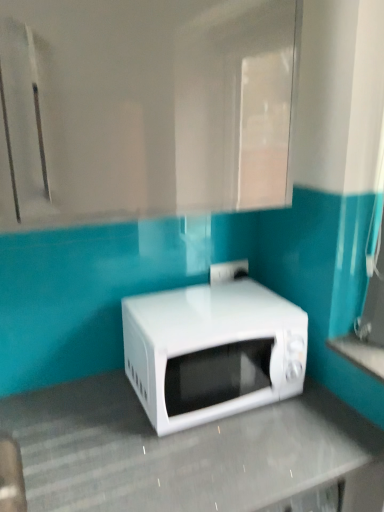
Question: From a real-world perspective, is white glossy countertop at lower right, placed as the second counter top when sorted from bottom to top, below white glossy microwave at center?

Choices:
 (A) no
 (B) yes

Answer: (A)

Question: Does white glossy countertop at lower right, the first counter top when ordered from top to bottom, appear on the right side of white glossy microwave at center?

Choices:
 (A) yes
 (B) no

Answer: (A)

Question: Is white glossy countertop at lower right, which is counted as the 1th counter top, starting from the right, wider than white glossy microwave at center?

Choices:
 (A) no
 (B) yes

Answer: (A)

Question: Can you confirm if white glossy countertop at lower right, the second counter top when ordered from left to right, is taller than white glossy microwave at center?

Choices:
 (A) yes
 (B) no

Answer: (B)

Question: Is the position of white glossy countertop at lower right, which is counted as the 1th counter top, starting from the right, more distant than that of white glossy microwave at center?

Choices:
 (A) no
 (B) yes

Answer: (A)

Question: Considering the relative positions of white glossy countertop at lower right, the first counter top when ordered from top to bottom, and white glossy microwave at center in the image provided, is white glossy countertop at lower right, the first counter top when ordered from top to bottom, to the left of white glossy microwave at center from the viewer's perspective?

Choices:
 (A) yes
 (B) no

Answer: (B)

Question: Could you tell me if white glossy microwave at center, the 2th counter top when ordered from right to left, is turned towards white glossy microwave at center?

Choices:
 (A) yes
 (B) no

Answer: (B)

Question: Can you confirm if white glossy microwave at center, the first counter top from the bottom, is positioned to the right of white glossy microwave at center?

Choices:
 (A) yes
 (B) no

Answer: (B)

Question: Considering the relative sizes of white glossy microwave at center, the 2th counter top when ordered from right to left, and white glossy microwave at center in the image provided, is white glossy microwave at center, the 2th counter top when ordered from right to left, taller than white glossy microwave at center?

Choices:
 (A) no
 (B) yes

Answer: (B)

Question: Is white glossy microwave at center, placed as the 2th counter top when sorted from top to bottom, facing away from white glossy microwave at center?

Choices:
 (A) yes
 (B) no

Answer: (B)

Question: From the image's perspective, would you say white glossy microwave at center, the first counter top from the bottom, is shown under white glossy microwave at center?

Choices:
 (A) no
 (B) yes

Answer: (B)

Question: Is white glossy microwave at center, the first counter top from the bottom, to the left of white glossy microwave at center from the viewer's perspective?

Choices:
 (A) no
 (B) yes

Answer: (B)

Question: Is white glossy microwave at center beside white glossy countertop at lower right, which is counted as the 1th counter top, starting from the right?

Choices:
 (A) no
 (B) yes

Answer: (A)